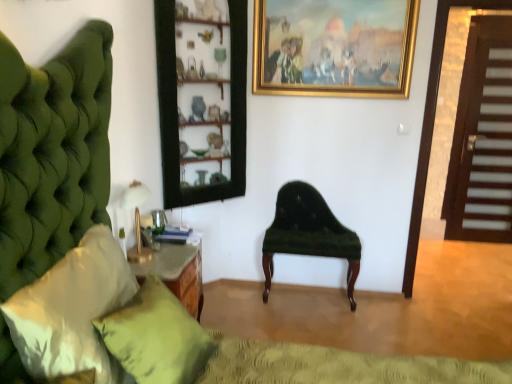
Question: Looking at the image, does gold-framed painting at upper center seem bigger or smaller compared to green fabric pillow at lower left, placed as the second pillow when sorted from front to back?

Choices:
 (A) small
 (B) big

Answer: (A)

Question: From a real-world perspective, is gold-framed painting at upper center above or below green fabric pillow at lower left, positioned as the first pillow in back-to-front order?

Choices:
 (A) above
 (B) below

Answer: (A)

Question: Estimate the real-world distances between objects in this image. Which object is closer to the white satin pillow at left, arranged as the first pillow when viewed from the front?

Choices:
 (A) green fabric pillow at lower left, positioned as the first pillow in back-to-front order
 (B) gold-framed painting at upper center
 (C) gold metallic table lamp at left
 (D) brown wooden door at right
 (E) wooden shelves at center

Answer: (A)

Question: Estimate the real-world distances between objects in this image. Which object is closer to the gold metallic table lamp at left?

Choices:
 (A) brown wooden door at right
 (B) wooden shelves at center
 (C) velvet green bench at center
 (D) green fabric pillow at lower left, placed as the second pillow when sorted from front to back
 (E) gold-framed painting at upper center

Answer: (D)